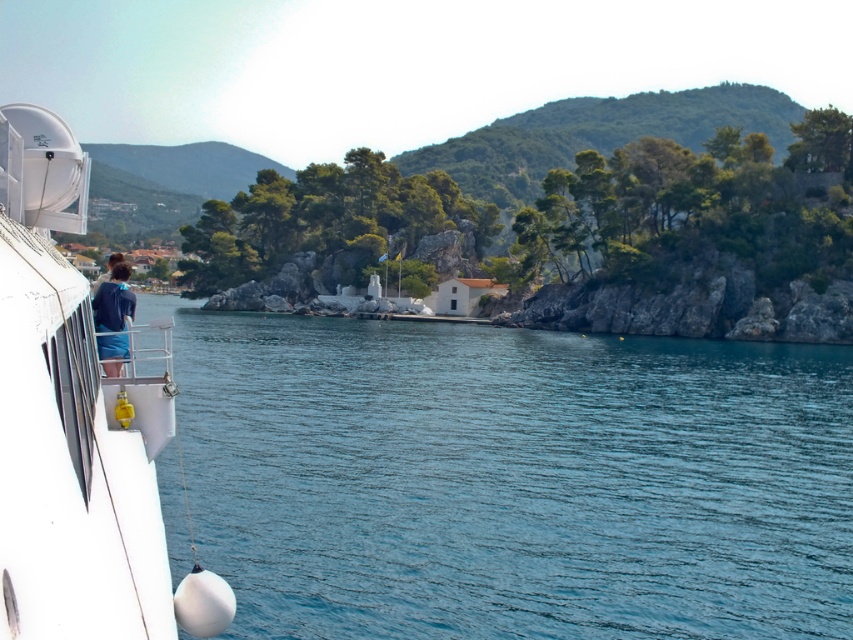
You are standing on the ship deck and want to take a photo of the white glossy boat at left and the clear blue water at center. Which object should you focus on first if you want to capture both in one shot?

You should focus on the white glossy boat at left first because the clear blue water at center is to the right of it, ensuring both are within the frame.

You are a sailor on the ship and want to know if the clear blue water at center is wider than the white glossy boat at left. Can you confirm this?

The clear blue water at center is wider than the white glossy boat at left, so yes, the clear blue water at center is wider than the white glossy boat at left.